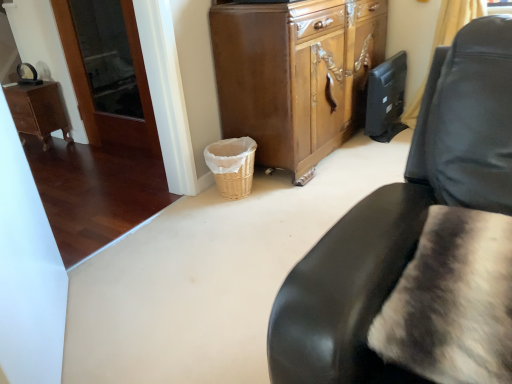
Question: Can you confirm if fuzzy fur pillow at lower right is smaller than wooden desk at left?

Choices:
 (A) yes
 (B) no

Answer: (A)

Question: Is fuzzy fur pillow at lower right positioned before wooden desk at left?

Choices:
 (A) yes
 (B) no

Answer: (A)

Question: Can you confirm if fuzzy fur pillow at lower right is thinner than wooden desk at left?

Choices:
 (A) yes
 (B) no

Answer: (B)

Question: Is fuzzy fur pillow at lower right to the right of wooden desk at left from the viewer's perspective?

Choices:
 (A) yes
 (B) no

Answer: (A)

Question: From a real-world perspective, is fuzzy fur pillow at lower right under wooden desk at left?

Choices:
 (A) no
 (B) yes

Answer: (A)

Question: Based on their positions, is yellow fabric curtain at upper right located to the left or right of wooden cabinet at center?

Choices:
 (A) left
 (B) right

Answer: (B)

Question: Relative to wooden cabinet at center, is yellow fabric curtain at upper right in front or behind?

Choices:
 (A) front
 (B) behind

Answer: (B)

Question: From a real-world perspective, is yellow fabric curtain at upper right physically located above or below wooden cabinet at center?

Choices:
 (A) above
 (B) below

Answer: (B)

Question: Which is correct: yellow fabric curtain at upper right is inside wooden cabinet at center, or outside of it?

Choices:
 (A) inside
 (B) outside

Answer: (B)

Question: Considering their positions, is wooden desk at left located in front of or behind wooden cabinet at center?

Choices:
 (A) front
 (B) behind

Answer: (B)

Question: In the image, is wooden desk at left on the left side or the right side of wooden cabinet at center?

Choices:
 (A) left
 (B) right

Answer: (A)

Question: From a real-world perspective, relative to wooden cabinet at center, is wooden desk at left vertically above or below?

Choices:
 (A) above
 (B) below

Answer: (B)

Question: From the image's perspective, is wooden desk at left positioned above or below wooden cabinet at center?

Choices:
 (A) below
 (B) above

Answer: (A)

Question: From the image's perspective, relative to yellow fabric curtain at upper right, is fuzzy fur pillow at lower right above or below?

Choices:
 (A) above
 (B) below

Answer: (B)

Question: From a real-world perspective, is fuzzy fur pillow at lower right above or below yellow fabric curtain at upper right?

Choices:
 (A) above
 (B) below

Answer: (A)